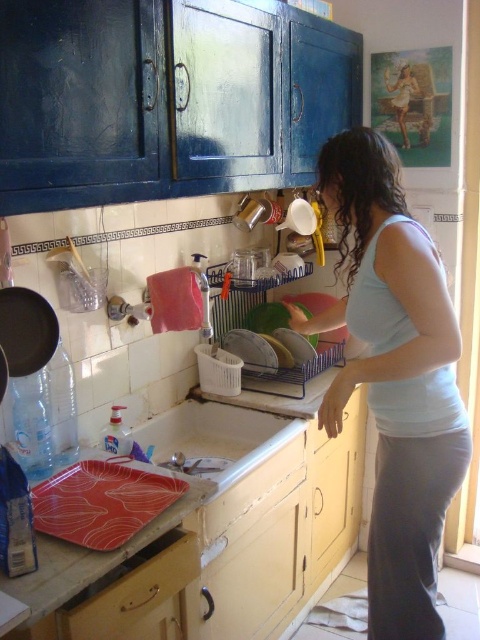
You are standing in the kitchen and want to place a plate on the counter near the sink. Which object should you place it on, the white glossy counter top at sink or the white glossy sink at lower center?

You should place the plate on the white glossy counter top at sink because it is closer to the viewer than the white glossy sink at lower center, making it the appropriate surface for placing items.

You are standing in the kitchen and want to reach the point at coordinates (360, 365). Can you comfortably extend your arm to reach it without moving closer?

The distance of point (360, 365) from viewer is 1.44 meters. A typical arm length is about 0.7 meters, so you cannot comfortably reach it without moving closer.

You are a person trying to reach the sink to wash your hands. You see the light blue tank top at center and the white glossy sink at lower center. Which object is closer to you, and can you reach the sink without moving the tank top?

The light blue tank top at center is taller than the white glossy sink at lower center, meaning it is positioned higher up. Since the sink is lower, you can likely reach it without moving the tank top as it is closer to your hand level.